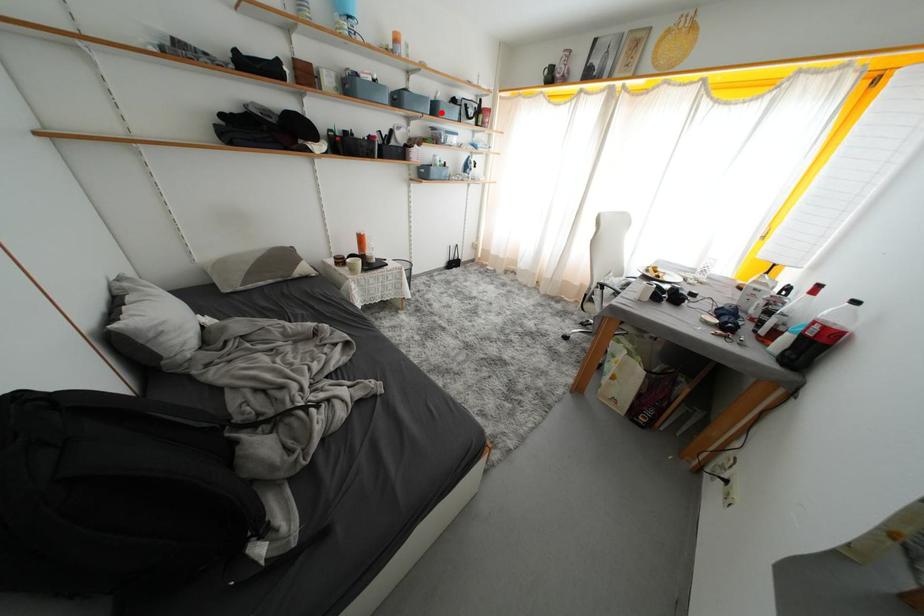
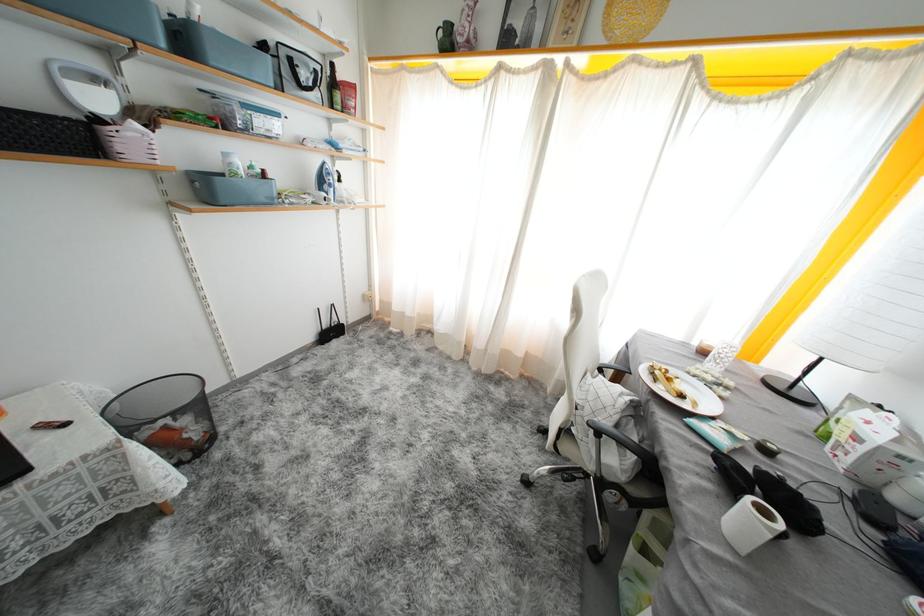
Question: I am providing you with two images of the same scene from different viewpoints. Given a red point in image1, look at the same physical point in image2. Is it:

Choices:
 (A) Closer to the viewpoint
 (B) Farther from the viewpoint

Answer: (B)